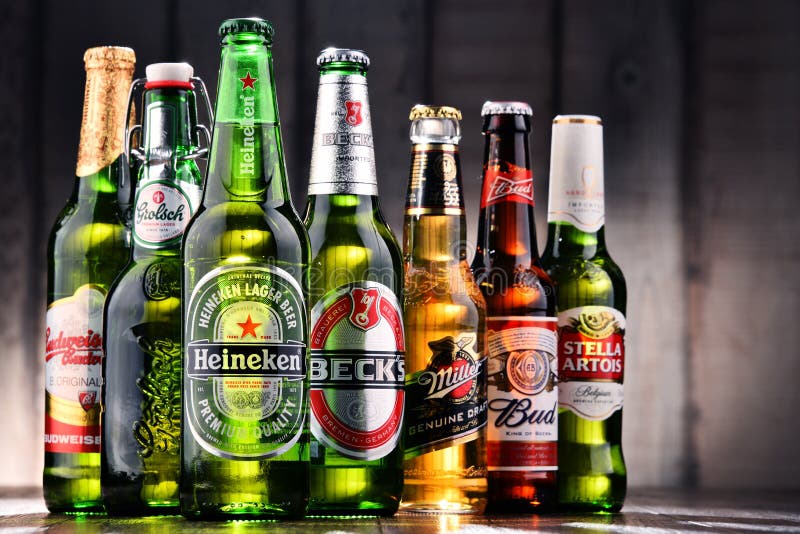
You are a GUI agent. You are given a task and a screenshot of the screen. Output one action in this format:
    pyautogui.click(x=<x>, y=<y>)
    Task: Click on the glass bottle
    This screenshot has width=800, height=534.
    Given the screenshot: What is the action you would take?
    pyautogui.click(x=104, y=223), pyautogui.click(x=158, y=282), pyautogui.click(x=228, y=217), pyautogui.click(x=338, y=231), pyautogui.click(x=448, y=267), pyautogui.click(x=509, y=269), pyautogui.click(x=600, y=277)